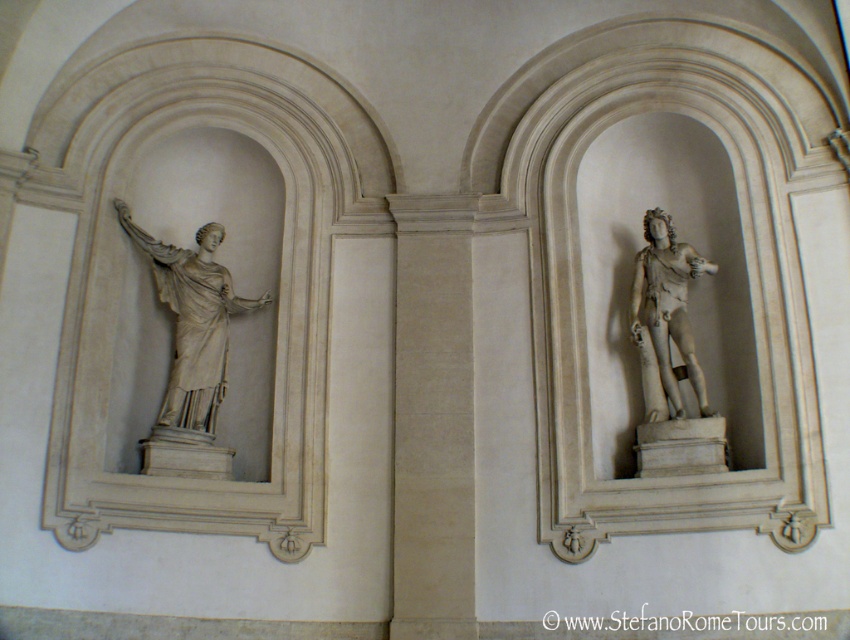
Question: Among these points, which one is farthest from the camera?

Choices:
 (A) (194, 349)
 (B) (656, 330)

Answer: (A)

Question: Which object is closer to the camera taking this photo?

Choices:
 (A) white marble statue at left
 (B) white marble statue at right

Answer: (B)

Question: In this image, where is white marble statue at left located relative to white marble statue at right?

Choices:
 (A) above
 (B) below

Answer: (A)

Question: Among these objects, which one is farthest from the camera?

Choices:
 (A) white marble statue at left
 (B) white marble statue at right

Answer: (A)

Question: Is white marble statue at left thinner than white marble statue at right?

Choices:
 (A) yes
 (B) no

Answer: (B)

Question: In this image, where is white marble statue at left located relative to white marble statue at right?

Choices:
 (A) above
 (B) below

Answer: (A)